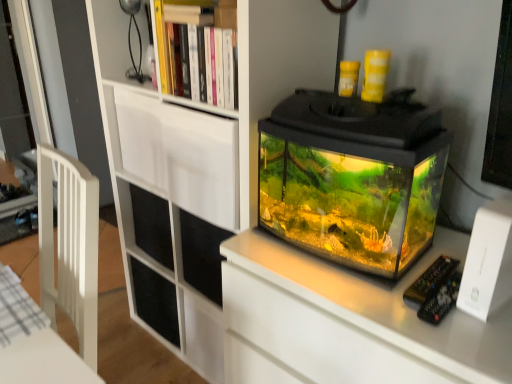
Question: From the image's perspective, is wooden bookshelf at upper center located above or below white matte bookcase at upper center?

Choices:
 (A) above
 (B) below

Answer: (A)

Question: Relative to white matte bookcase at upper center, is wooden bookshelf at upper center in front or behind?

Choices:
 (A) front
 (B) behind

Answer: (B)

Question: Which object is positioned closest to the transparent glass tank at center?

Choices:
 (A) white matte drawer at upper center
 (B) wooden bookshelf at upper center
 (C) white matte bookcase at upper center

Answer: (A)

Question: Considering the real-world distances, which object is closest to the transparent glass tank at center?

Choices:
 (A) white matte bookcase at upper center
 (B) white matte drawer at upper center
 (C) wooden bookshelf at upper center

Answer: (B)